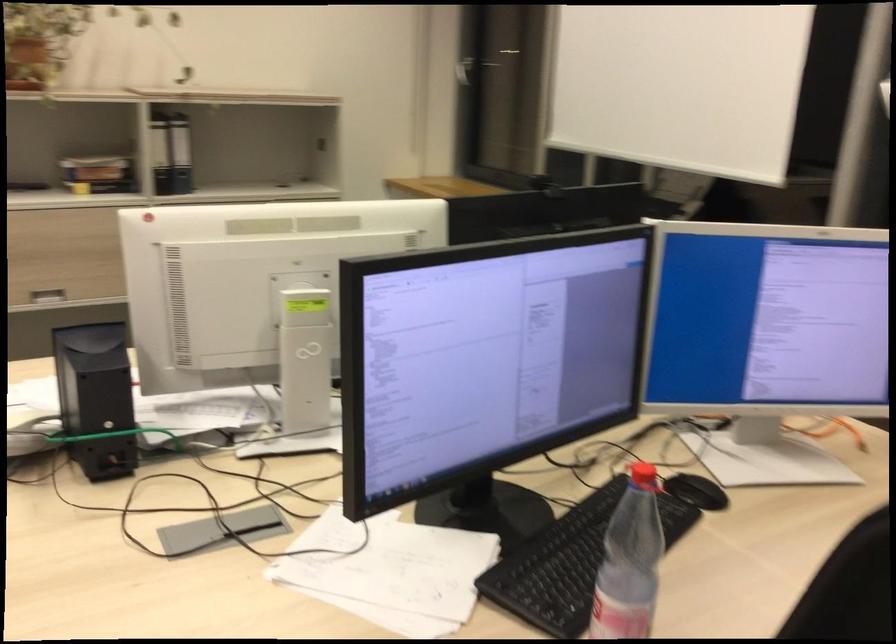
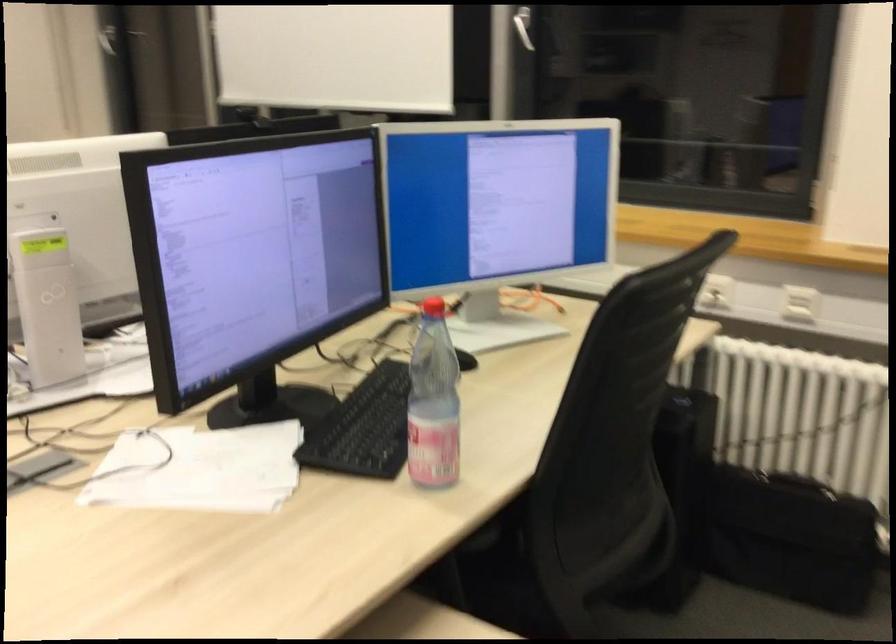
Question: The first image is from the beginning of the video and the second image is from the end. How did the camera likely rotate when shooting the video?

Choices:
 (A) Left
 (B) Right
 (C) Up
 (D) Down

Answer: (B)